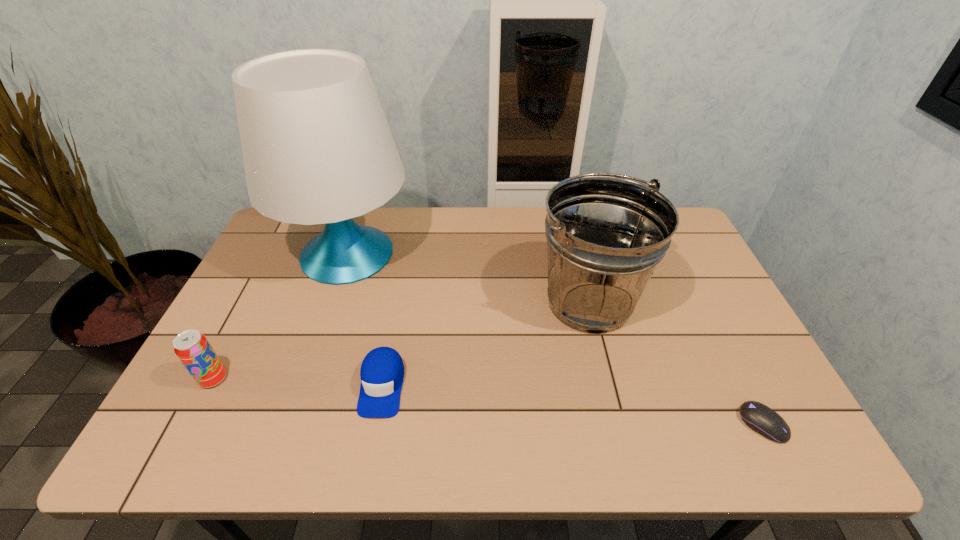
Find the location of a particular element. This screenshot has height=540, width=960. free space at the near edge of the desktop is located at coordinates (694, 425).

In the image, there is a desktop. Identify the location of free space at the left edge. This screenshot has width=960, height=540. (242, 357).

You are a GUI agent. You are given a task and a screenshot of the screen. Output one action in this format:
    pyautogui.click(x=<x>, y=<y>)
    Task: Click on the vacant space at the right edge
    
    Given the screenshot: What is the action you would take?
    pyautogui.click(x=726, y=404)

Image resolution: width=960 pixels, height=540 pixels. What are the coordinates of `free space at the far left corner of the desktop` in the screenshot? It's located at (287, 240).

Locate an element on the screen. This screenshot has height=540, width=960. free area in between the table lamp and the soda can is located at coordinates (280, 316).

Find the location of a particular element. free space between the shortest object and the soda can is located at coordinates (488, 401).

The image size is (960, 540). I want to click on vacant area that lies between the tallest object and the second tallest object, so click(468, 278).

Find the location of a particular element. The image size is (960, 540). free spot between the rightmost object and the second shortest object is located at coordinates (572, 405).

I want to click on unoccupied position between the bucket and the computer mouse, so click(x=676, y=363).

The height and width of the screenshot is (540, 960). What are the coordinates of `vacant region between the computer mouse and the bucket` in the screenshot? It's located at (676, 363).